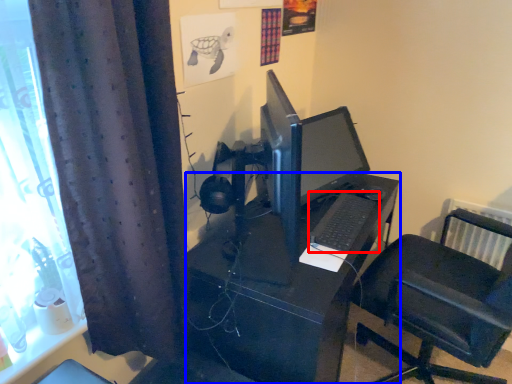
Question: Which point is further to the camera, computer keyboard (highlighted by a red box) or desk (highlighted by a blue box)?

Choices:
 (A) computer keyboard
 (B) desk

Answer: (A)